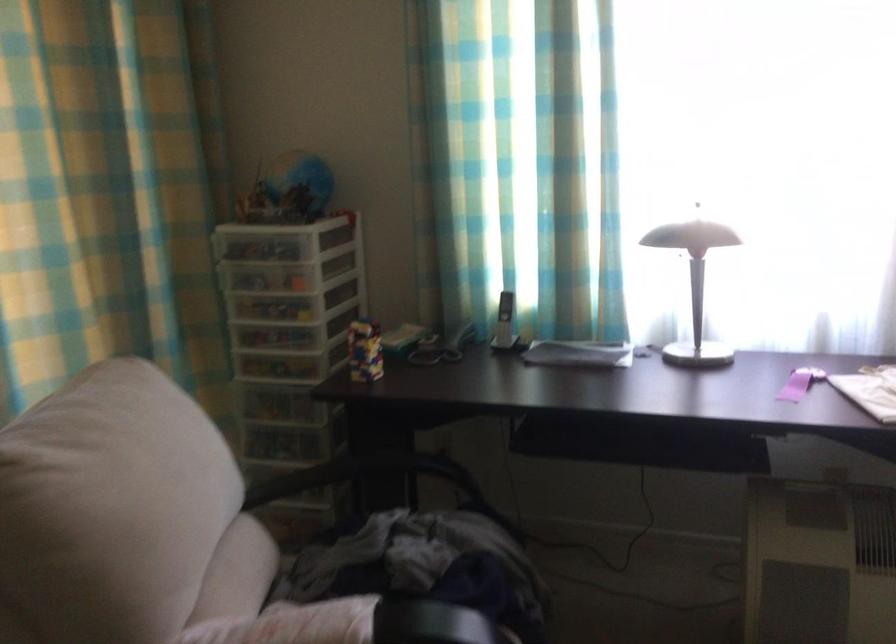
Describe the element at coordinates (362, 474) in the screenshot. This screenshot has width=896, height=644. I see `the sofa armrest` at that location.